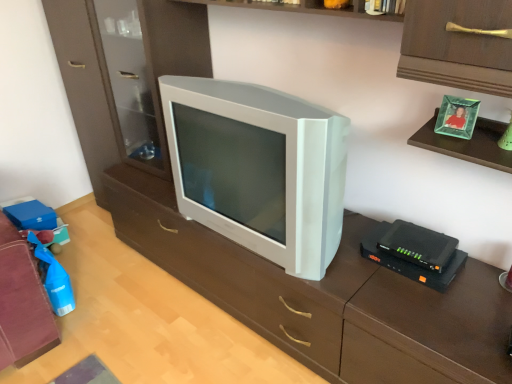
Question: Considering the positions of black plastic router at right and white plastic television at center in the image, is black plastic router at right taller or shorter than white plastic television at center?

Choices:
 (A) tall
 (B) short

Answer: (B)

Question: Do you think black plastic router at right is within white plastic television at center, or outside of it?

Choices:
 (A) outside
 (B) inside

Answer: (A)

Question: Estimate the real-world distances between objects in this image. Which object is farther from the white plastic television at center?

Choices:
 (A) white plastic tv at center
 (B) black plastic router at right

Answer: (B)

Question: Which object is the farthest from the white plastic television at center?

Choices:
 (A) black plastic router at right
 (B) white plastic tv at center

Answer: (A)